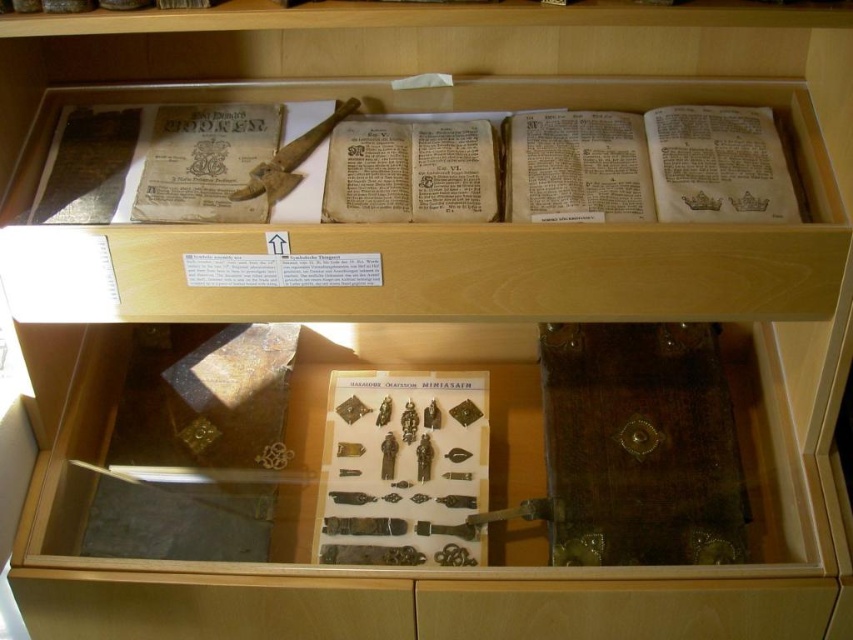
Consider the image. You are a museum curator who needs to move the yellowed paper book at upper left and the wooden staff at center to a new display case. The new case has a compartment that can only hold items within a 3.5 inches width. Can both items fit side by side in this compartment?

The yellowed paper book at upper left and the wooden staff at center are 3.20 inches apart from each other. Since the compartment can hold items within a 3.5 inches width, the total combined width of both items must be less than or equal to 3.5 inches. However, the distance between them being 3.20 inches does not directly indicate their individual or combined widths. Without knowing the individual dimensions of each item, it is impossible to determine if they can fit side by side in the compartment.

You are a museum visitor looking at the display cabinet. You see a point marked at coordinates (206, 163). Which object in the cabinet does this point correspond to?

The point corresponds to the yellowed paper book at upper left.

You are a museum curator trying to place a new artifact in the display cabinet. The artifact requires a specific location at point coordinates between 0.2 and 0.3 on the x and y axes. Can the yellowed paper book at upper left be placed there?

The yellowed paper book at upper left is already positioned at point coordinates of 0.255 on the x and 0.242 on the y, which falls within the specified range of 0.2 to 0.3 on both axes. Therefore, it can be placed there.